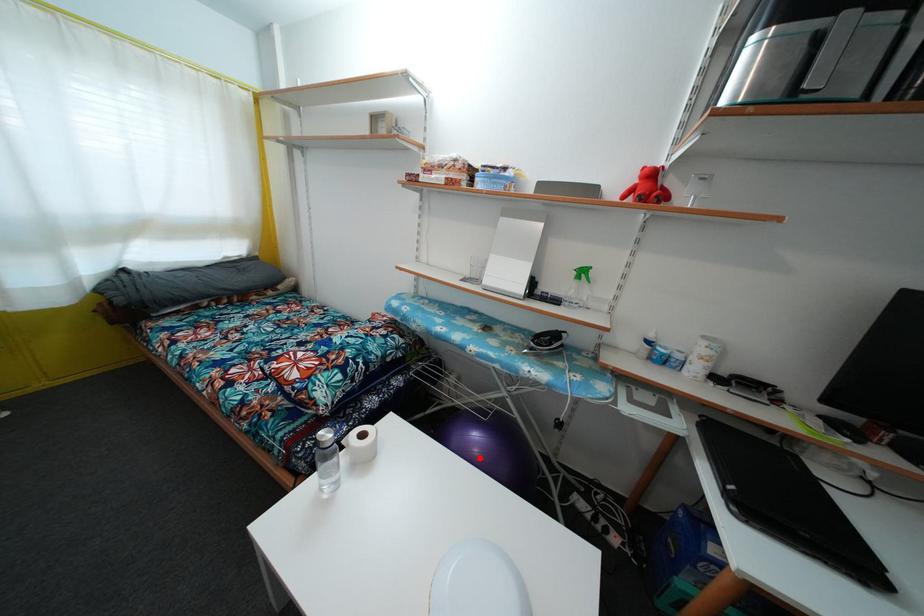
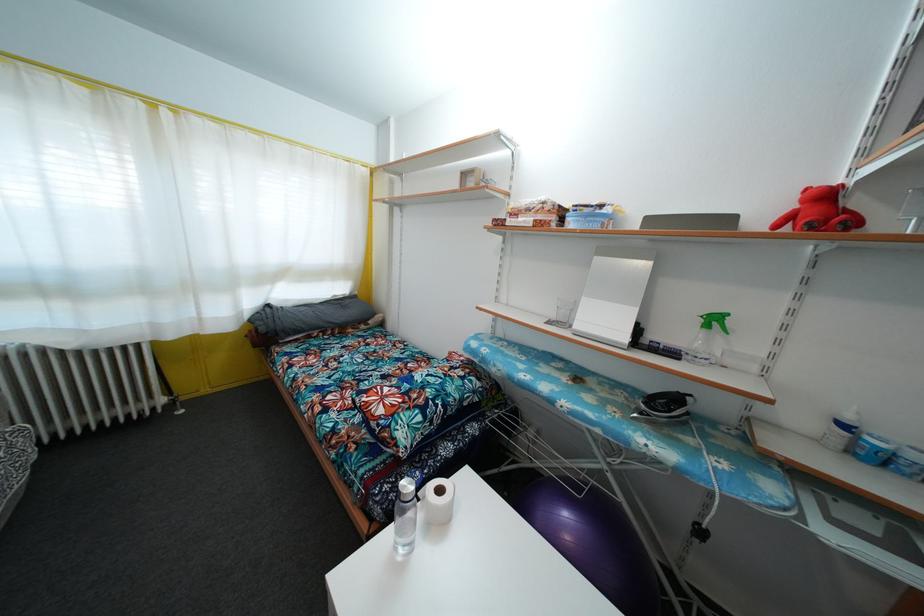
Locate, in the second image, the point that corresponds to the highlighted location in the first image.

(572, 545)